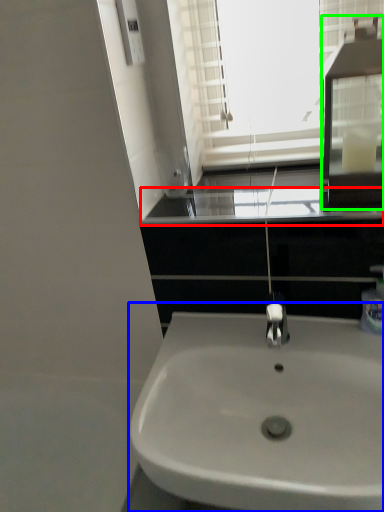
Question: Estimate the real-world distances between objects in this image. Which object is farther from window sill (highlighted by a red box), sink (highlighted by a blue box) or medicine cabinet (highlighted by a green box)?

Choices:
 (A) sink
 (B) medicine cabinet

Answer: (A)